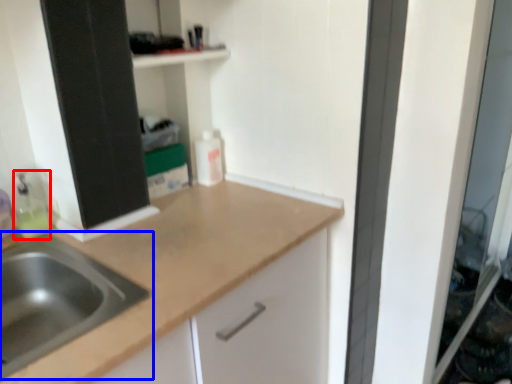
Question: Among these objects, which one is farthest to the camera, cleaning product (highlighted by a red box) or sink (highlighted by a blue box)?

Choices:
 (A) cleaning product
 (B) sink

Answer: (A)